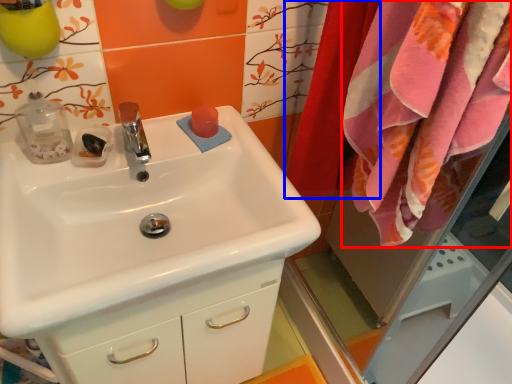
Question: Which object is further to the camera taking this photo, bath towel (highlighted by a red box) or curtain (highlighted by a blue box)?

Choices:
 (A) bath towel
 (B) curtain

Answer: (B)